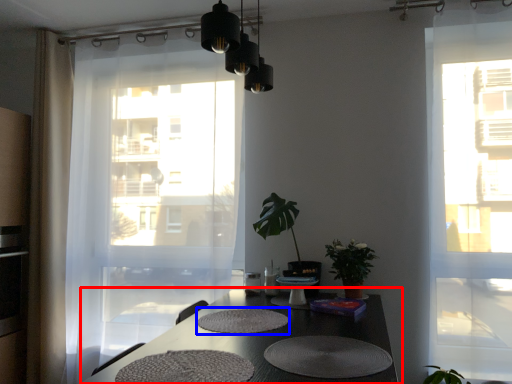
Question: Which object is further to the camera taking this photo, table (highlighted by a red box) or mat (highlighted by a blue box)?

Choices:
 (A) table
 (B) mat

Answer: (B)